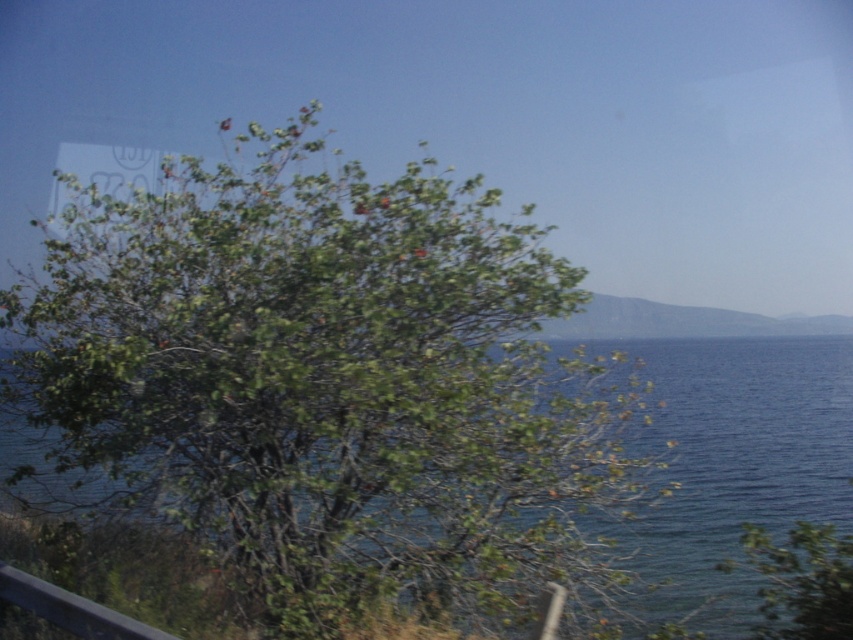
Question: Which point is closer to the camera?

Choices:
 (A) blue liquid water at center
 (B) dark gray metal rail at lower left
 (C) green leafy tree at center

Answer: (B)

Question: Which of these objects is positioned farthest from the blue liquid water at center?

Choices:
 (A) dark gray metal rail at lower left
 (B) green leafy tree at center

Answer: (B)

Question: Is green leafy tree at center below blue liquid water at center?

Choices:
 (A) no
 (B) yes

Answer: (A)

Question: Can you confirm if blue liquid water at center is positioned to the right of dark gray metal rail at lower left?

Choices:
 (A) no
 (B) yes

Answer: (B)

Question: Is green leafy tree at center closer to the viewer compared to dark gray metal rail at lower left?

Choices:
 (A) yes
 (B) no

Answer: (B)

Question: Which point is closer to the camera?

Choices:
 (A) blue liquid water at center
 (B) green leafy tree at center
 (C) dark gray metal rail at lower left

Answer: (C)